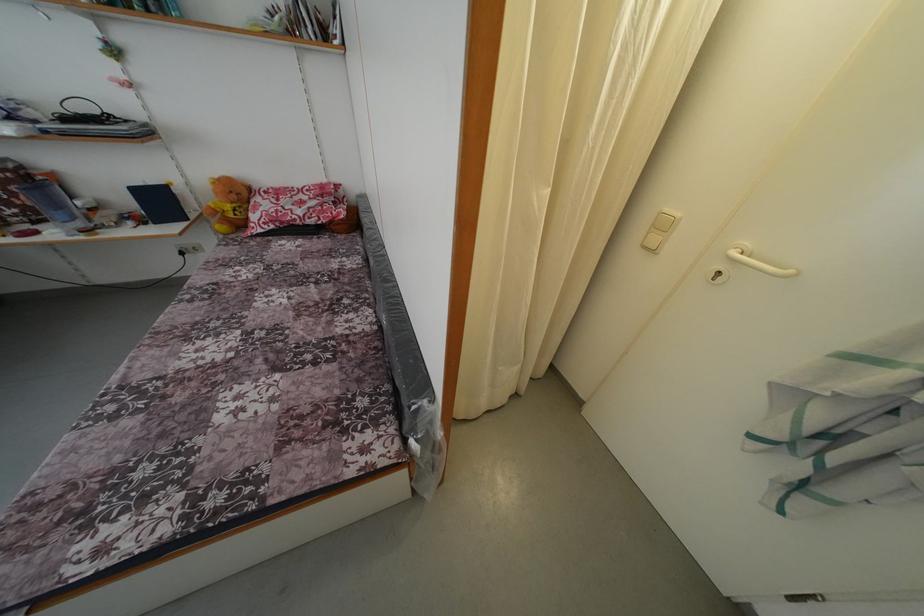
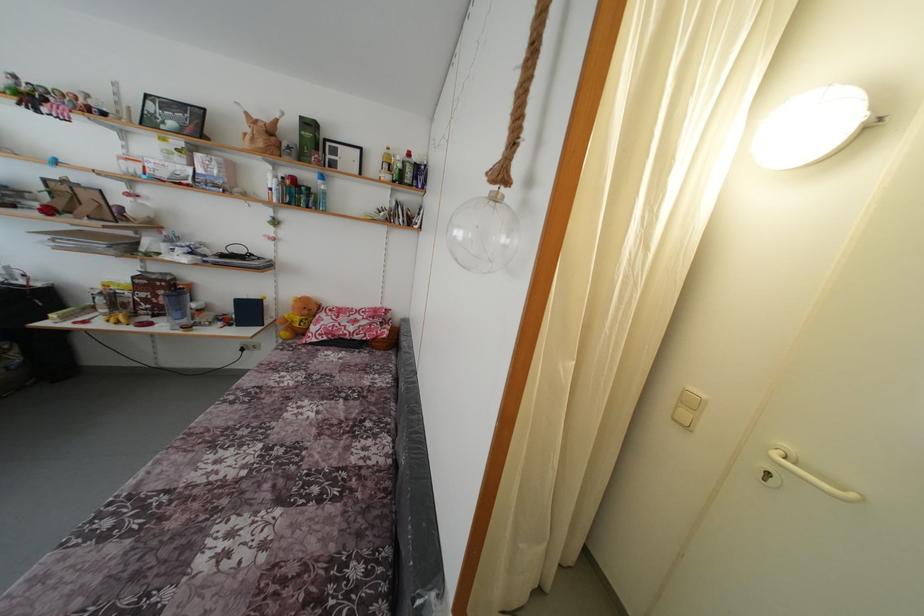
In the second image, find the point that corresponds to [672,216] in the first image.

(696, 394)